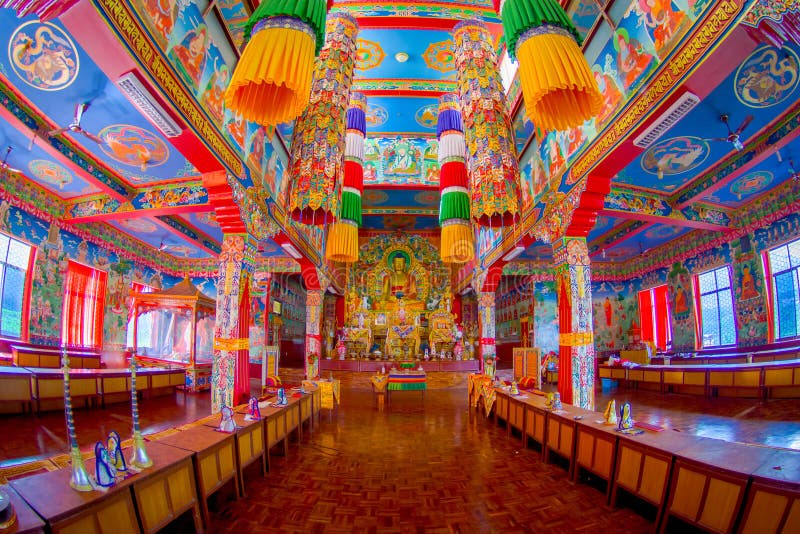
Where is `ceiling fan`? The height and width of the screenshot is (534, 800). ceiling fan is located at coordinates (72, 127), (732, 134).